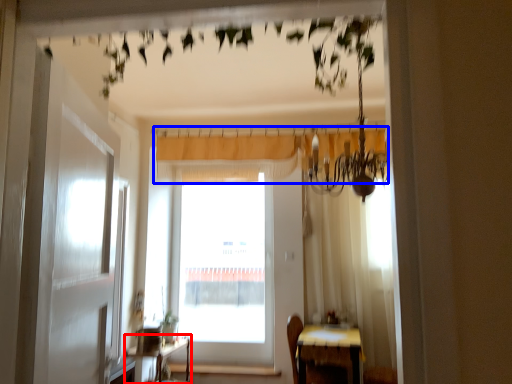
Question: Which point is further to the camera, table (highlighted by a red box) or curtain (highlighted by a blue box)?

Choices:
 (A) table
 (B) curtain

Answer: (B)